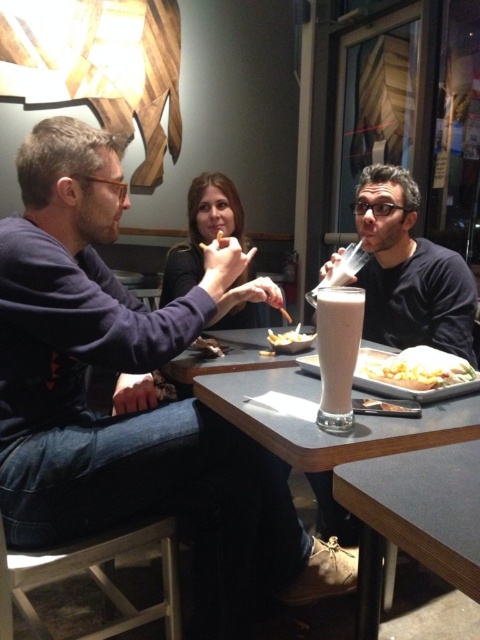
Measure the distance between smooth gray table at lower right and camera.

smooth gray table at lower right is 21.95 inches away from camera.

Is smooth gray table at lower right further to camera compared to smooth gray table at center?

No, it is not.

What do you see at coordinates (414, 518) in the screenshot? The width and height of the screenshot is (480, 640). I see `smooth gray table at lower right` at bounding box center [414, 518].

The width and height of the screenshot is (480, 640). Identify the location of smooth gray table at lower right. (414, 518).

Image resolution: width=480 pixels, height=640 pixels. Describe the element at coordinates (414, 518) in the screenshot. I see `smooth gray table at lower right` at that location.

Looking at this image, does smooth gray table at lower right have a greater height compared to golden crispy fries at center?

Yes.

Does point (444, 486) lie in front of point (300, 342)?

That is True.

The image size is (480, 640). In order to click on smooth gray table at lower right in this screenshot , I will do `click(414, 518)`.

Is point (213, 177) farther from viewer compared to point (202, 344)?

Yes, point (213, 177) is behind point (202, 344).

Image resolution: width=480 pixels, height=640 pixels. Describe the element at coordinates (203, 230) in the screenshot. I see `matte black shirt at center` at that location.

The image size is (480, 640). Identify the location of matte black shirt at center. (203, 230).